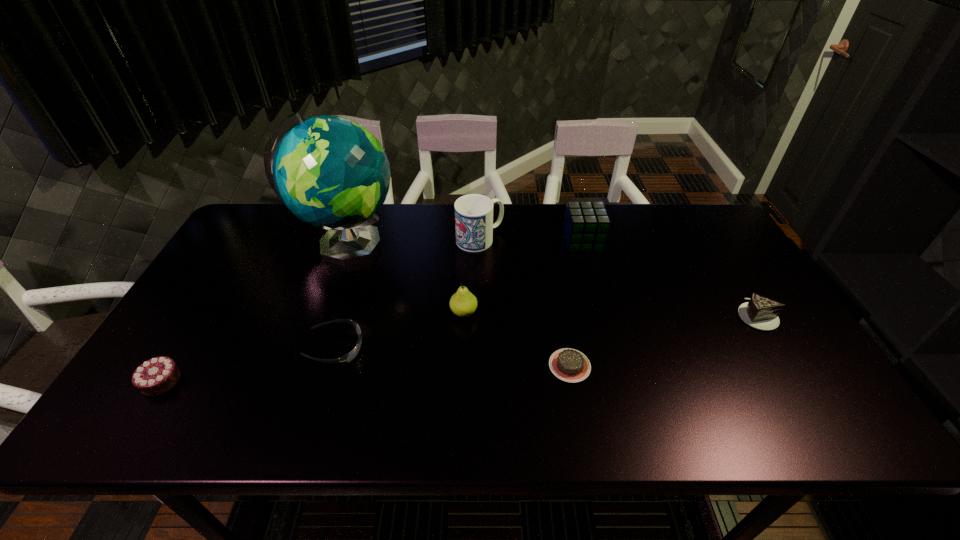
The height and width of the screenshot is (540, 960). I want to click on cube that is positioned at the far edge, so click(586, 225).

Where is `object present at the left edge`? object present at the left edge is located at coordinates (156, 376).

You are a GUI agent. You are given a task and a screenshot of the screen. Output one action in this format:
    pyautogui.click(x=<x>, y=<y>)
    Task: Click on the object that is at the right edge
    The height and width of the screenshot is (540, 960).
    Given the screenshot: What is the action you would take?
    pyautogui.click(x=760, y=312)

In the image, there is a desktop. Where is `free region at the far edge`? free region at the far edge is located at coordinates (533, 205).

Find the location of a particular element. The image size is (960, 540). vacant space at the near edge of the desktop is located at coordinates (282, 409).

Where is `vacant space at the left edge of the desktop`? The width and height of the screenshot is (960, 540). vacant space at the left edge of the desktop is located at coordinates (208, 369).

Find the location of a particular element. The image size is (960, 540). vacant space at the near right corner of the desktop is located at coordinates (837, 430).

The width and height of the screenshot is (960, 540). I want to click on free space between the farthest chocolate cake and the shortest chocolate cake, so click(663, 341).

The image size is (960, 540). Identify the location of free space between the farthest chocolate cake and the leftmost object. (459, 348).

Where is `free space that is in between the pear and the second object from right to left`? free space that is in between the pear and the second object from right to left is located at coordinates (523, 277).